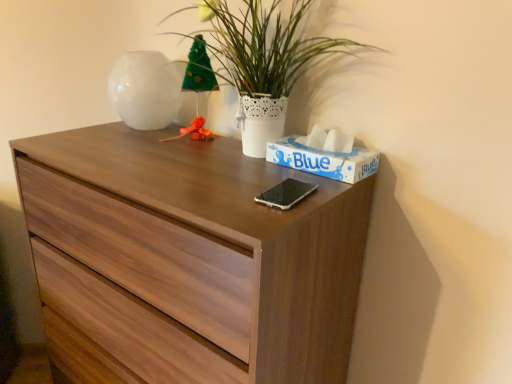
Question: In terms of size, does blue cardboard tissue box at upper right appear bigger or smaller than wooden chest of drawers at center?

Choices:
 (A) small
 (B) big

Answer: (A)

Question: In terms of width, does blue cardboard tissue box at upper right look wider or thinner when compared to wooden chest of drawers at center?

Choices:
 (A) wide
 (B) thin

Answer: (B)

Question: Which object is positioned closest to the white glossy vase at upper left?

Choices:
 (A) blue cardboard tissue box at upper right
 (B) wooden chest of drawers at center
 (C) green leafy plant at upper center

Answer: (C)

Question: Estimate the real-world distances between objects in this image. Which object is farther from the blue cardboard tissue box at upper right?

Choices:
 (A) wooden chest of drawers at center
 (B) green leafy plant at upper center
 (C) white glossy vase at upper left

Answer: (C)